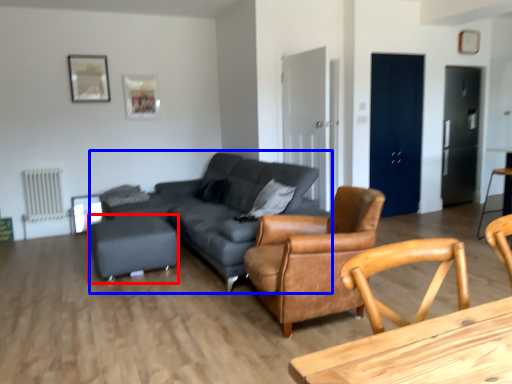
Question: Which point is closer to the camera, bar stool (highlighted by a red box) or studio couch (highlighted by a blue box)?

Choices:
 (A) bar stool
 (B) studio couch

Answer: (B)